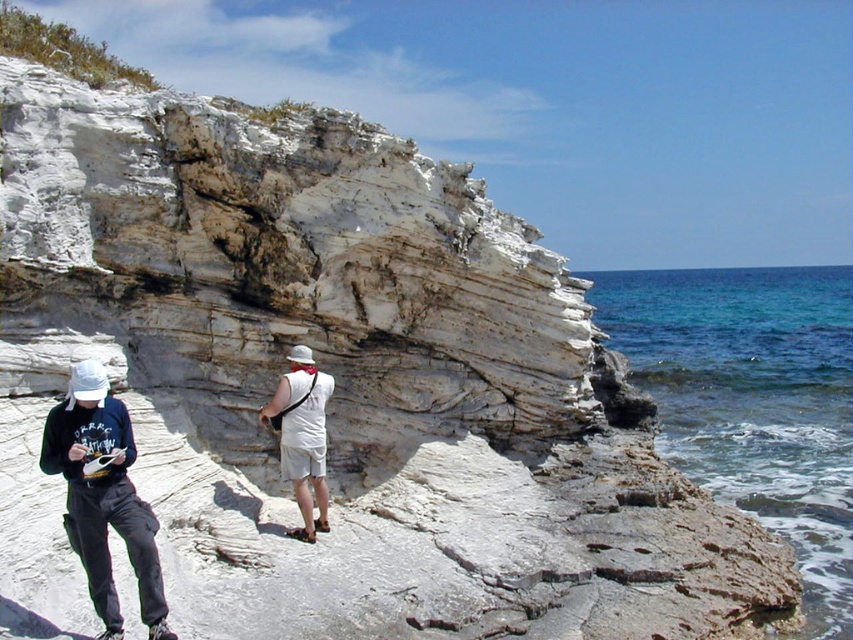
Is dark blue cotton hoodie at lower left to the left of matte black hoodie at lower left from the viewer's perspective?

In fact, dark blue cotton hoodie at lower left is to the right of matte black hoodie at lower left.

At what (x,y) coordinates should I click in order to perform the action: click on dark blue cotton hoodie at lower left. Please return your answer as a coordinate pair (x, y). The image size is (853, 640). Looking at the image, I should click on (103, 497).

Which is in front, point (321, 525) or point (94, 576)?

Point (94, 576)

Locate an element on the screen. dark blue cotton hoodie at lower left is located at coordinates (103, 497).

Between clear blue water at lower right and white cotton shirt at center, which one is positioned lower?

white cotton shirt at center

Does clear blue water at lower right appear over white cotton shirt at center?

Indeed, clear blue water at lower right is positioned over white cotton shirt at center.

Does point (735, 305) come farther from viewer compared to point (323, 432)?

Yes, it is.

Locate an element on the screen. The height and width of the screenshot is (640, 853). clear blue water at lower right is located at coordinates (752, 401).

Which is in front, point (103, 371) or point (320, 378)?

Point (103, 371)

Where is `matte black hoodie at lower left`? The image size is (853, 640). matte black hoodie at lower left is located at coordinates (103, 497).